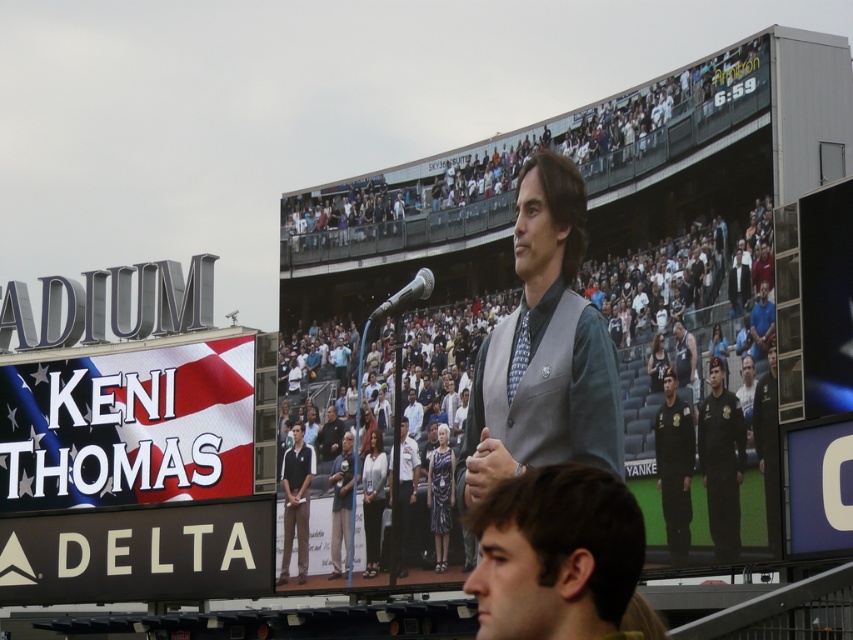
Question: Is dark brown hair at lower center to the right of black plastic sign at lower left from the viewer's perspective?

Choices:
 (A) no
 (B) yes

Answer: (B)

Question: Can you confirm if black plastic sign at lower left is bigger than blue plastic letter o at center?

Choices:
 (A) yes
 (B) no

Answer: (A)

Question: Among these points, which one is farthest from the camera?

Choices:
 (A) (413, 285)
 (B) (552, 236)

Answer: (A)

Question: Does white fabric sign at left have a lesser width compared to gray fabric vest at center?

Choices:
 (A) yes
 (B) no

Answer: (B)

Question: Which of the following is the farthest from the observer?

Choices:
 (A) (577, 218)
 (B) (148, 426)
 (C) (25, 556)
 (D) (425, 280)

Answer: (C)

Question: Which is farther from the black plastic sign at lower left?

Choices:
 (A) shiny silver microphone at center
 (B) gray fabric vest at center
 (C) blue plastic letter o at center

Answer: (C)